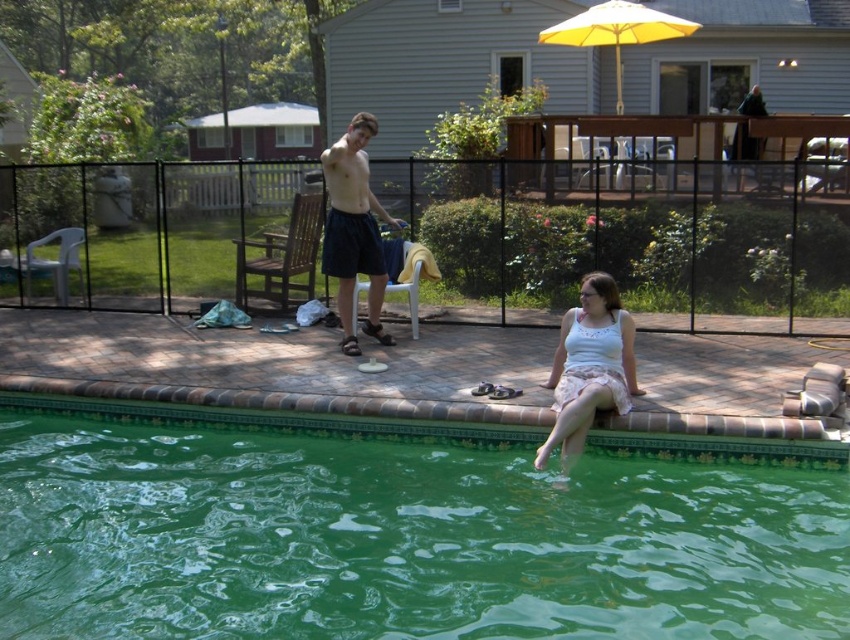
You are standing at the edge of the swimming pool and want to locate the green glossy water at lower center. According to the coordinates given, where exactly should you look?

The green glossy water at lower center is located at coordinates point (401, 540).

Looking at this image, you are a photographer taking a picture of the green glossy water at lower center and the white lace dress at lower right. Which object should you focus on first if you want to capture both in the same frame without moving the camera?

The green glossy water at lower center should be focused on first since it is positioned on the left side of the white lace dress at lower right, allowing the photographer to adjust the framing to include both objects in the shot.

You are a photographer setting up a shoot in the backyard. You have a white lace dress at lower right and a yellow fabric umbrella at upper right in your frame. Which object should you adjust to ensure both are in focus, considering their height difference?

The white lace dress at lower right is taller than the yellow fabric umbrella at upper right. To ensure both are in focus, adjust the camera to focus on the white lace dress at lower right first, as it is the taller object, and then check the focus on the yellow fabric umbrella at upper right.